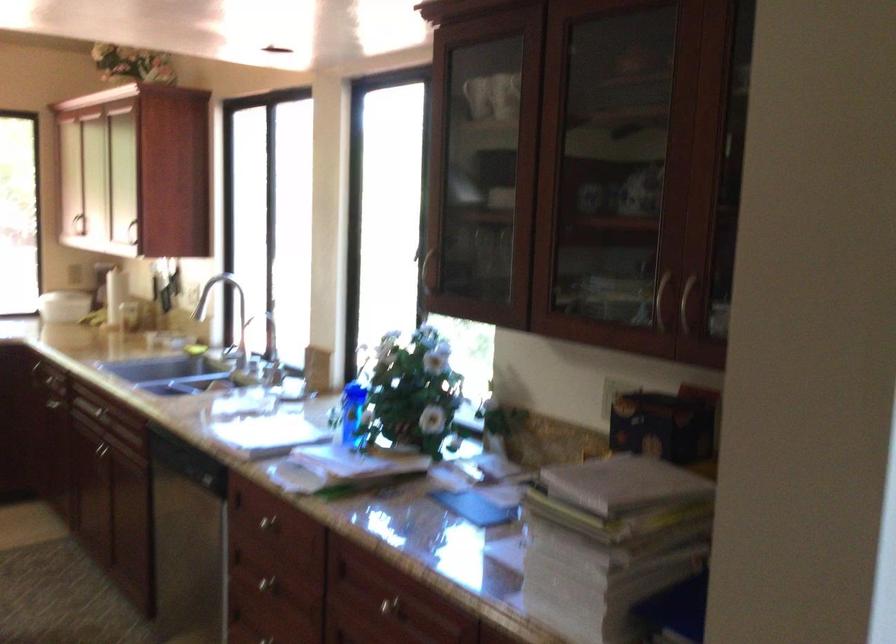
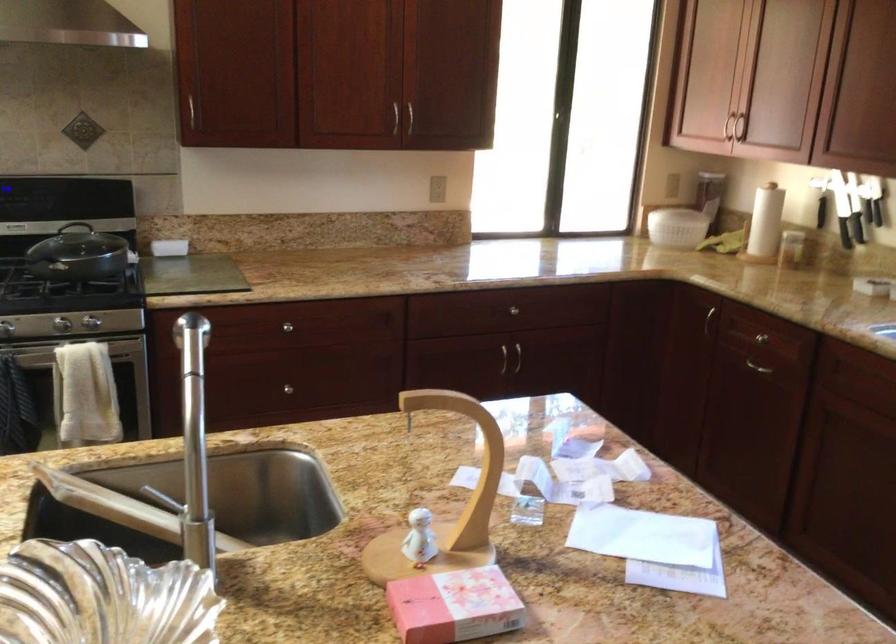
Which direction would the cameraman need to move to produce the second image?

The cameraman walked toward left, forward.